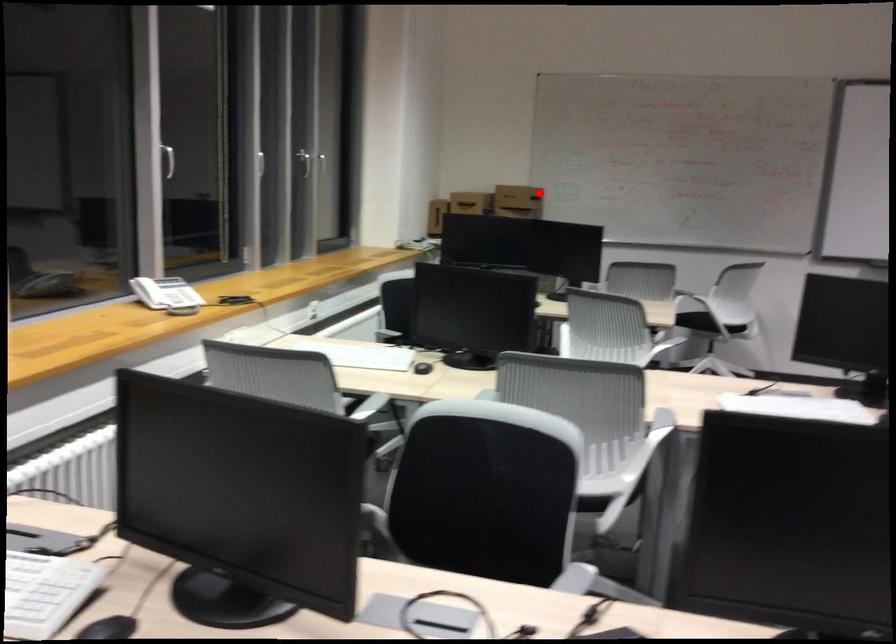
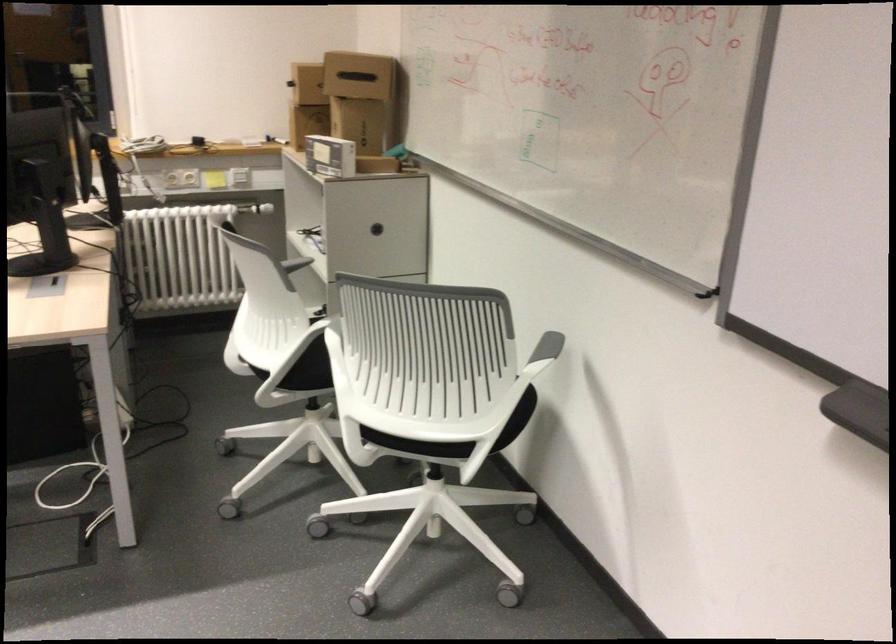
Question: I am providing you with two images of the same scene from different viewpoints. In image1, a red point is highlighted. Considering the same 3D point in image2, which of the following is correct?

Choices:
 (A) It is closer
 (B) It is farther

Answer: (A)